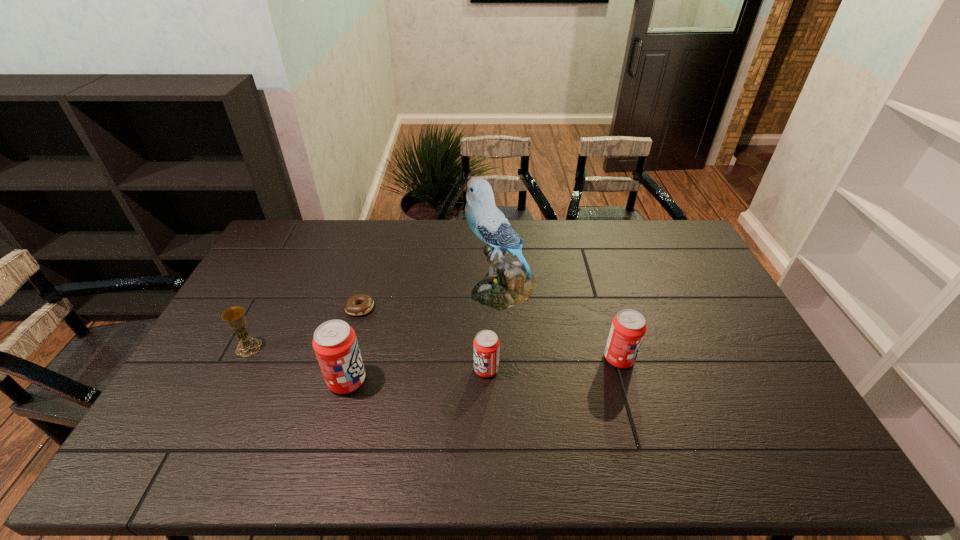
I want to click on the leftmost soda can, so click(335, 344).

You are a GUI agent. You are given a task and a screenshot of the screen. Output one action in this format:
    pyautogui.click(x=<x>, y=<y>)
    Task: Click on the fifth shortest object
    
    Given the screenshot: What is the action you would take?
    [x=335, y=344]

Where is `the shortest soda can`? the shortest soda can is located at coordinates (x=486, y=344).

The image size is (960, 540). In order to click on the rightmost soda can in this screenshot , I will do `click(628, 328)`.

Find the location of `the rightmost object`. the rightmost object is located at coordinates (628, 328).

Where is `the tallest object`? the tallest object is located at coordinates (506, 284).

You are a GUI agent. You are given a task and a screenshot of the screen. Output one action in this format:
    pyautogui.click(x=<x>, y=<y>)
    Task: Click on the chalice
    This screenshot has width=960, height=540.
    Given the screenshot: What is the action you would take?
    pyautogui.click(x=235, y=318)

Where is `the shortest object`? This screenshot has width=960, height=540. the shortest object is located at coordinates (367, 302).

The height and width of the screenshot is (540, 960). I want to click on vacant space located 0.160m on the surface of the leftmost soda can, so click(424, 380).

Where is `vacant space located 0.120m on the surface of the shortest soda can`? The width and height of the screenshot is (960, 540). vacant space located 0.120m on the surface of the shortest soda can is located at coordinates (431, 369).